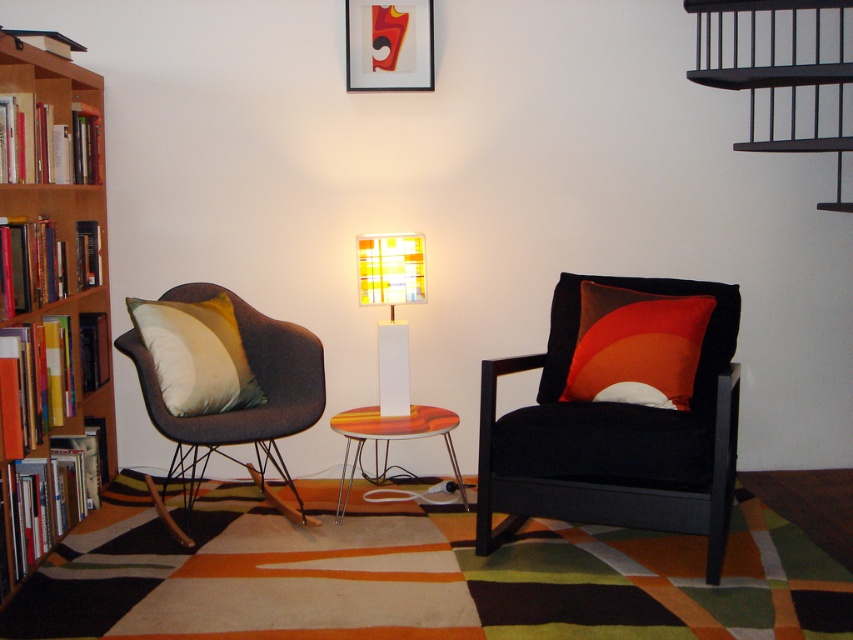
Question: Is matte orange cushion at right bigger than wooden/marble side table at center?

Choices:
 (A) no
 (B) yes

Answer: (A)

Question: Does dark gray fabric swivel chair at left appear over wooden/marble side table at center?

Choices:
 (A) no
 (B) yes

Answer: (B)

Question: Which object is positioned closest to the matte black picture frame at upper center?

Choices:
 (A) silky beige pillow at left
 (B) dark gray fabric swivel chair at left
 (C) black metal stairs at upper right

Answer: (C)

Question: Which point is farther to the camera?

Choices:
 (A) white glossy rectangular lamp at center
 (B) black velvet armchair at center
 (C) black metal stairs at upper right
 (D) dark gray fabric swivel chair at left

Answer: (A)

Question: Is silky beige pillow at left thinner than white glossy rectangular lamp at center?

Choices:
 (A) no
 (B) yes

Answer: (A)

Question: Which of the following is the farthest from the observer?

Choices:
 (A) wooden bookcase at left
 (B) wooden/marble side table at center
 (C) white glossy rectangular lamp at center
 (D) silky beige pillow at left

Answer: (C)